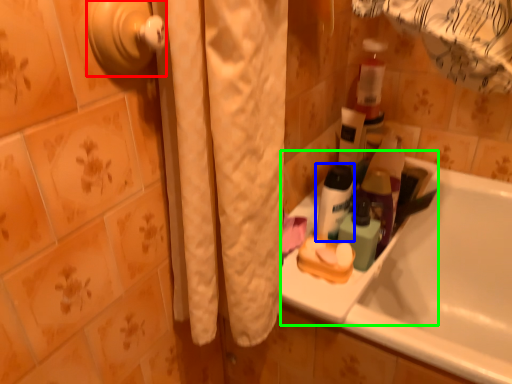
Question: Based on their relative distances, which object is nearer to door handle (highlighted by a red box)? Choose from toiletry (highlighted by a blue box) and sink (highlighted by a green box).

Choices:
 (A) toiletry
 (B) sink

Answer: (A)